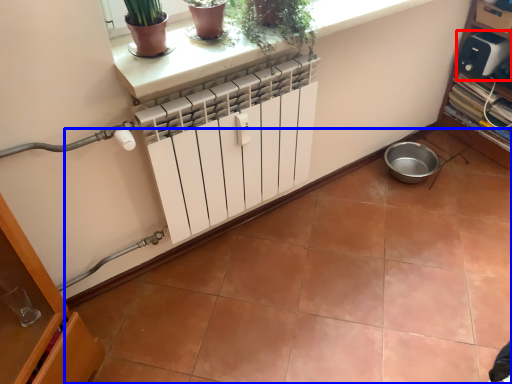
Question: Which of the following is the farthest to the observer, appliance (highlighted by a red box) or ceramic tile (highlighted by a blue box)?

Choices:
 (A) appliance
 (B) ceramic tile

Answer: (A)